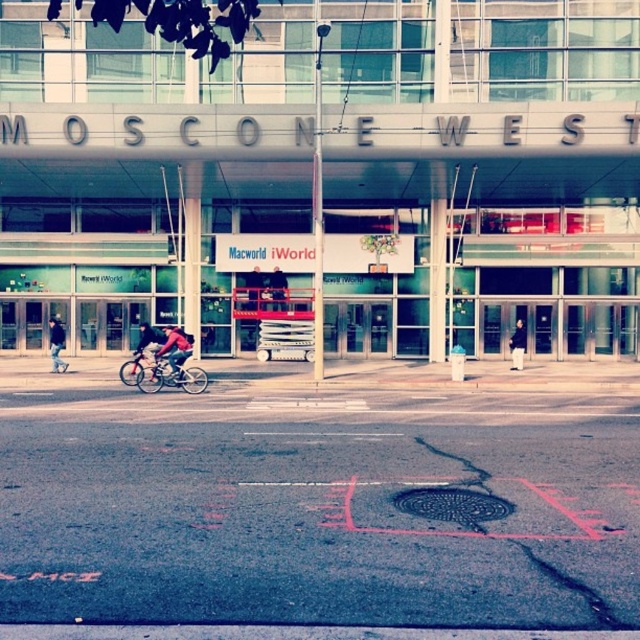
Question: Based on their relative distances, which object is farther from the shiny metallic bicycle at center-left?

Choices:
 (A) red jacket at center
 (B) dark blue jeans at left
 (C) black leather jacket at center
 (D) silver metallic bicycle at center-left

Answer: (C)

Question: In this image, where is silver metallic bicycle at center-left located relative to shiny metallic bicycle at center-left?

Choices:
 (A) right
 (B) left

Answer: (A)

Question: Which point is farther to the camera?

Choices:
 (A) (52, 365)
 (B) (138, 355)

Answer: (A)

Question: Does shiny metallic bicycle at center-left come in front of black leather jacket at center?

Choices:
 (A) yes
 (B) no

Answer: (A)

Question: Which object appears farthest from the camera in this image?

Choices:
 (A) silver metallic bicycle at center-left
 (B) red jacket at center
 (C) dark blue jeans at left
 (D) shiny metallic bicycle at center-left

Answer: (C)

Question: Observing the image, what is the correct spatial positioning of shiny metallic bicycle at center-left in reference to dark blue jeans at left?

Choices:
 (A) above
 (B) below

Answer: (B)